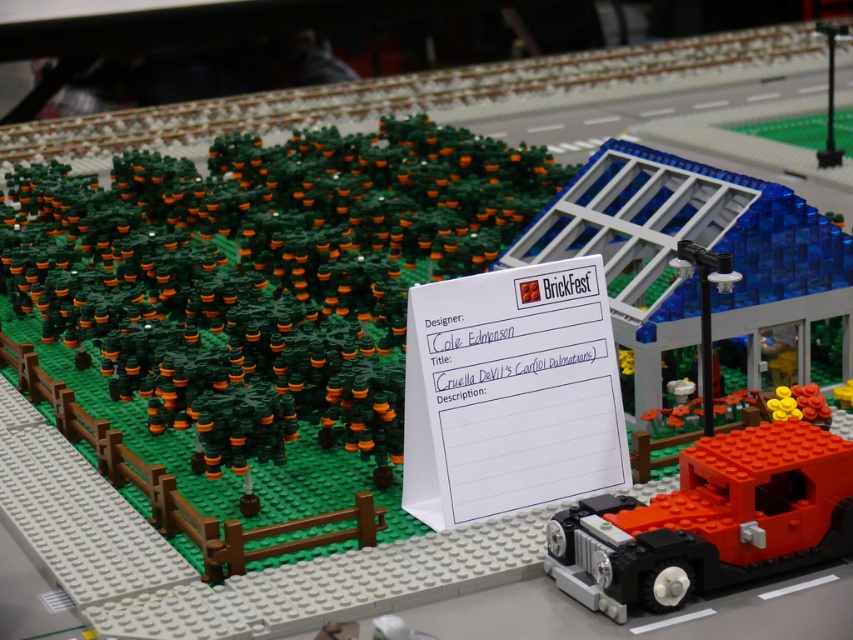
Between green matte trees at upper left and brick red car at lower right, which one is positioned lower?

brick red car at lower right

Is green matte trees at upper left taller than brick red car at lower right?

Yes.

Who is more forward, (x=170, y=161) or (x=663, y=609)?

Point (x=663, y=609)

Image resolution: width=853 pixels, height=640 pixels. What are the coordinates of `green matte trees at upper left` in the screenshot? It's located at (263, 273).